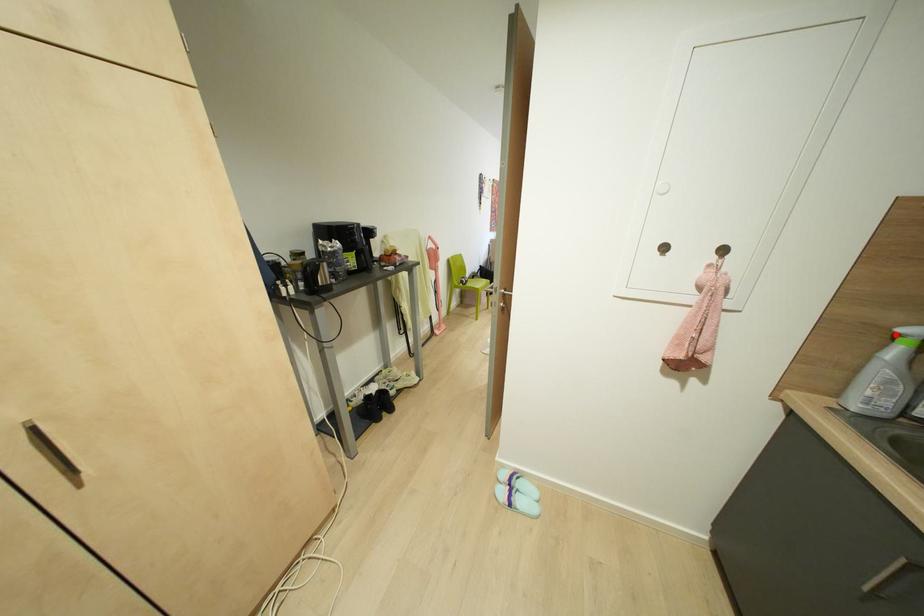
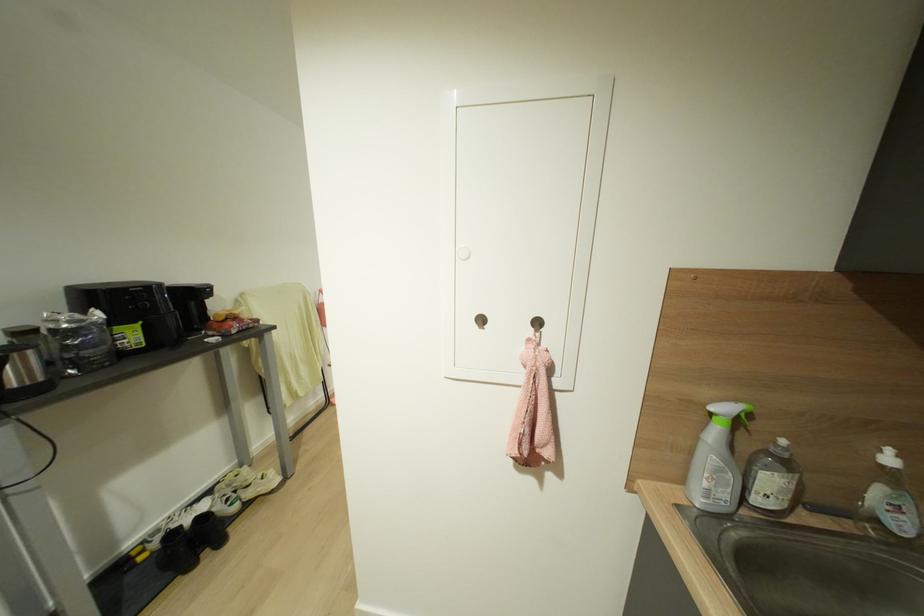
Question: I am providing you with two images of the same scene from different viewpoints. A red point is marked on the first image. Is the red point's position out of view in image 2?

Choices:
 (A) Yes
 (B) No

Answer: (B)